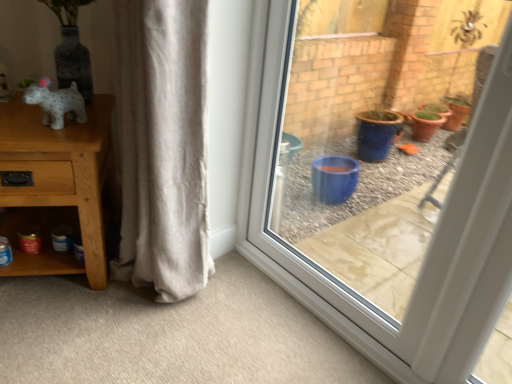
Question: Is speckled white dog at left not inside wooden table at left?

Choices:
 (A) yes
 (B) no

Answer: (A)

Question: Considering the relative sizes of speckled white dog at left and wooden table at left in the image provided, is speckled white dog at left bigger than wooden table at left?

Choices:
 (A) no
 (B) yes

Answer: (A)

Question: Can you confirm if speckled white dog at left is shorter than wooden table at left?

Choices:
 (A) no
 (B) yes

Answer: (B)

Question: Is speckled white dog at left to the left of wooden table at left from the viewer's perspective?

Choices:
 (A) no
 (B) yes

Answer: (A)

Question: From the image's perspective, is speckled white dog at left beneath wooden table at left?

Choices:
 (A) no
 (B) yes

Answer: (A)

Question: Considering their positions, is speckled white dog at left located in front of or behind wooden table at left?

Choices:
 (A) behind
 (B) front

Answer: (A)

Question: Looking at their shapes, would you say speckled white dog at left is wider or thinner than wooden table at left?

Choices:
 (A) wide
 (B) thin

Answer: (B)

Question: Is speckled white dog at left bigger or smaller than wooden table at left?

Choices:
 (A) small
 (B) big

Answer: (A)

Question: Is point (60, 92) closer or farther from the camera than point (76, 147)?

Choices:
 (A) farther
 (B) closer

Answer: (A)

Question: Looking at their shapes, would you say transparent glass window at center is wider or thinner than speckled white dog at left?

Choices:
 (A) wide
 (B) thin

Answer: (B)

Question: Is transparent glass window at center taller or shorter than speckled white dog at left?

Choices:
 (A) short
 (B) tall

Answer: (B)

Question: Would you say transparent glass window at center is to the left or to the right of speckled white dog at left in the picture?

Choices:
 (A) left
 (B) right

Answer: (B)

Question: From a real-world perspective, relative to speckled white dog at left, is transparent glass window at center vertically above or below?

Choices:
 (A) below
 (B) above

Answer: (A)

Question: From the image's perspective, is beige cotton curtain at center located above or below wooden table at left?

Choices:
 (A) below
 (B) above

Answer: (B)

Question: Considering the positions of beige cotton curtain at center and wooden table at left in the image, is beige cotton curtain at center wider or thinner than wooden table at left?

Choices:
 (A) wide
 (B) thin

Answer: (B)